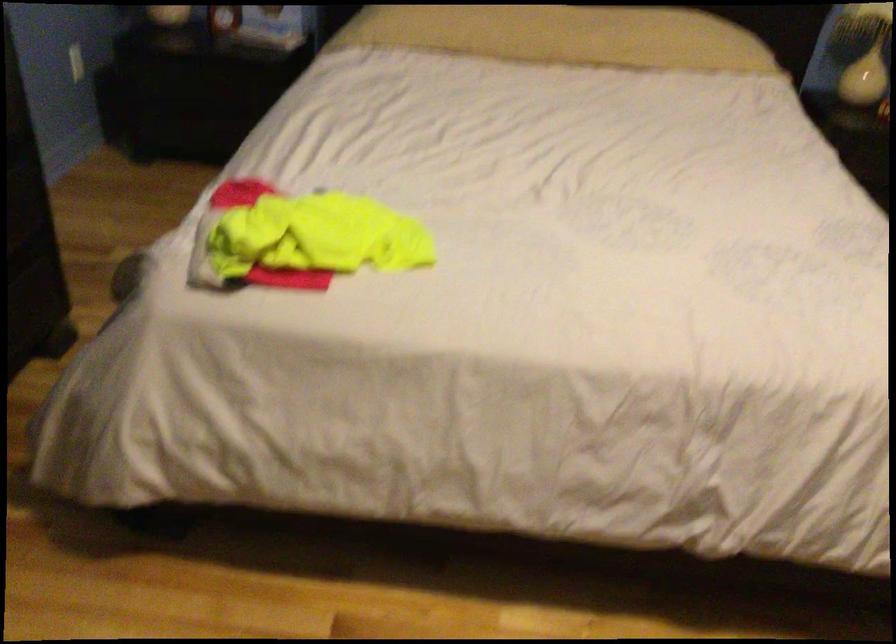
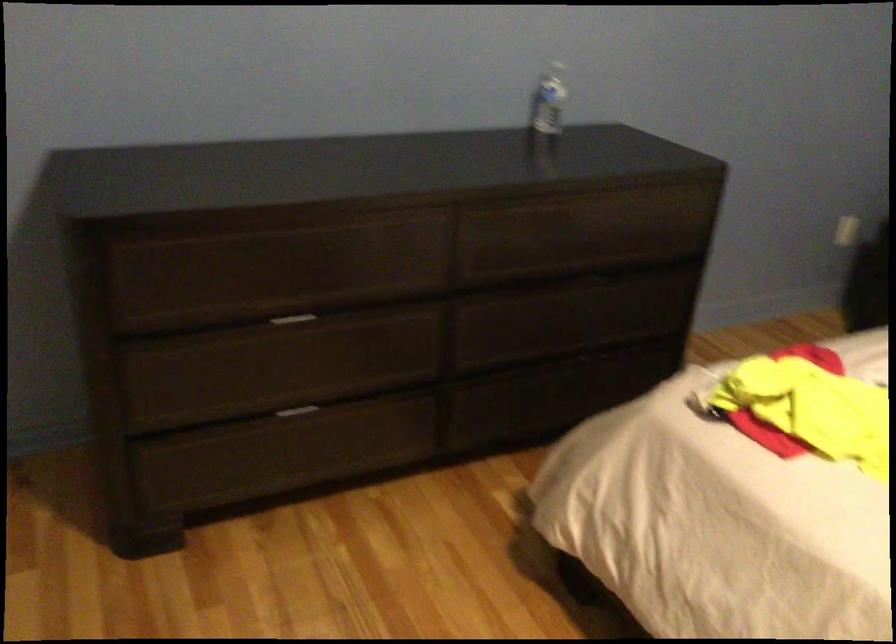
Question: The camera is either moving clockwise (left) or counter-clockwise (right) around the object. The first image is from the beginning of the video and the second image is from the end. Is the camera moving left or right when shooting the video?

Choices:
 (A) Left
 (B) Right

Answer: (B)